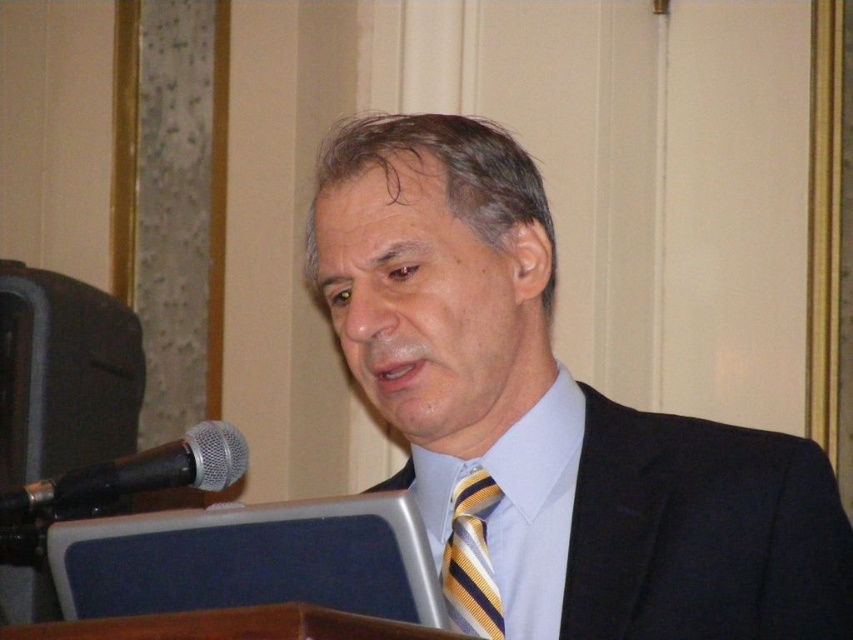
Which of these two, black textured suit at center or black metallic microphone at left, stands taller?

Standing taller between the two is black textured suit at center.

Find the location of a particular element. The width and height of the screenshot is (853, 640). black textured suit at center is located at coordinates (699, 531).

Locate an element on the screen. The width and height of the screenshot is (853, 640). black textured suit at center is located at coordinates (x=699, y=531).

You are a GUI agent. You are given a task and a screenshot of the screen. Output one action in this format:
    pyautogui.click(x=<x>, y=<y>)
    Task: Click on the black textured suit at center
    This screenshot has height=640, width=853.
    Given the screenshot: What is the action you would take?
    pyautogui.click(x=699, y=531)

Between light blue satin dress shirt at center and black metallic microphone at left, which one has more height?

light blue satin dress shirt at center

Is light blue satin dress shirt at center above black metallic microphone at left?

No.

The width and height of the screenshot is (853, 640). What are the coordinates of `light blue satin dress shirt at center` in the screenshot? It's located at (517, 506).

The image size is (853, 640). I want to click on light blue satin dress shirt at center, so click(x=517, y=506).

Which is above, dark blue suit at center or black metallic microphone at left?

Positioned higher is dark blue suit at center.

Which of these two, dark blue suit at center or black metallic microphone at left, stands shorter?

black metallic microphone at left

Is point (733, 452) farther from viewer compared to point (175, 465)?

That is False.

The height and width of the screenshot is (640, 853). In order to click on dark blue suit at center in this screenshot , I will do `click(436, 276)`.